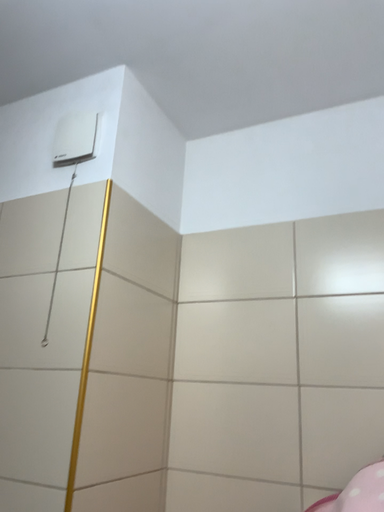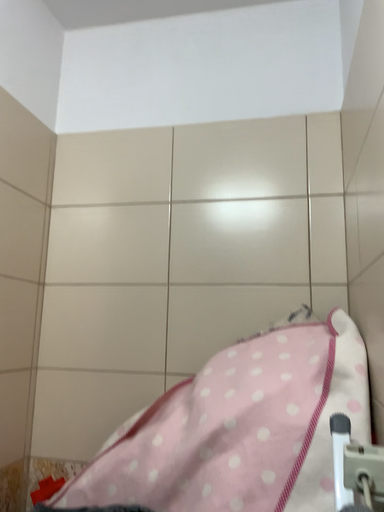
Question: Which way did the camera rotate in the video?

Choices:
 (A) rotated left
 (B) rotated right

Answer: (B)